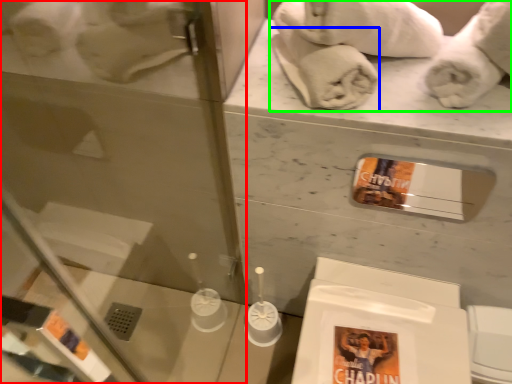
Question: Which object is positioned farthest from glass door (highlighted by a red box)? Select from bath towel (highlighted by a blue box) and bath towel (highlighted by a green box).

Choices:
 (A) bath towel
 (B) bath towel

Answer: (A)